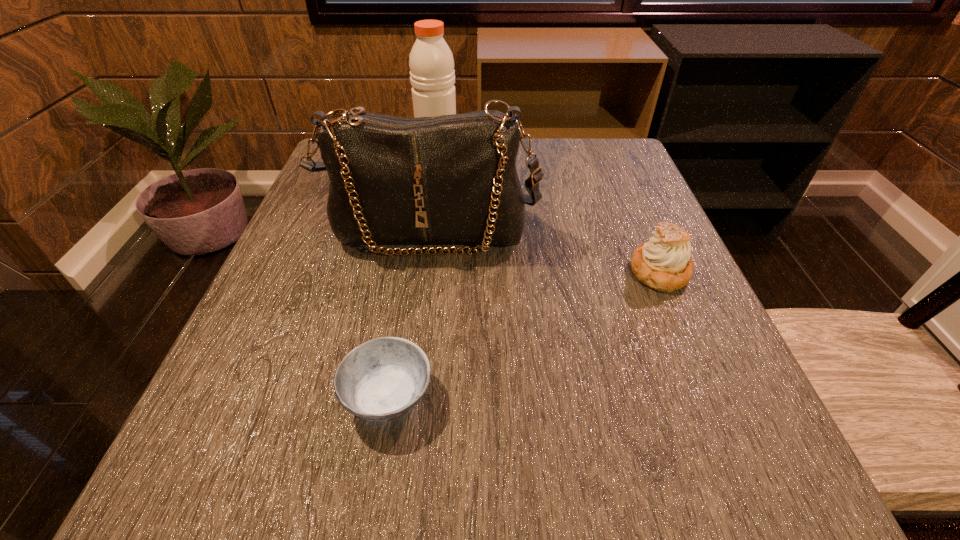
At what (x,y) coordinates should I click in order to perform the action: click on object positioned at the far edge. Please return your answer as a coordinate pair (x, y). Looking at the image, I should click on (432, 75).

The image size is (960, 540). In order to click on object that is at the left edge in this screenshot , I will do `click(446, 179)`.

Identify the location of object present at the right edge. The height and width of the screenshot is (540, 960). (663, 263).

At what (x,y) coordinates should I click in order to perform the action: click on vacant point at the far edge. Please return your answer as a coordinate pair (x, y). This screenshot has height=540, width=960. Looking at the image, I should click on (524, 157).

The height and width of the screenshot is (540, 960). In order to click on vacant space at the near edge of the desktop in this screenshot , I will do `click(635, 510)`.

Identify the location of blank space at the left edge. (282, 306).

Where is `vacant space at the right edge`? The image size is (960, 540). vacant space at the right edge is located at coordinates (619, 283).

Find the location of `free space at the far right corner of the desktop`. free space at the far right corner of the desktop is located at coordinates (588, 167).

Where is `free spot at the near right corner of the desktop`? free spot at the near right corner of the desktop is located at coordinates coord(650,452).

Locate an element on the screen. free space between the farthest object and the rightmost object is located at coordinates (x=549, y=213).